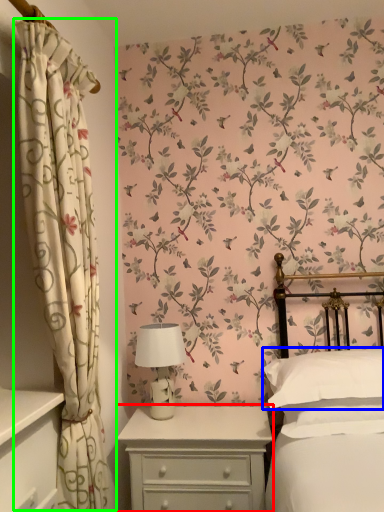
Question: Estimate the real-world distances between objects in this image. Which object is closer to nightstand (highlighted by a red box), pillow (highlighted by a blue box) or curtain (highlighted by a green box)?

Choices:
 (A) pillow
 (B) curtain

Answer: (A)